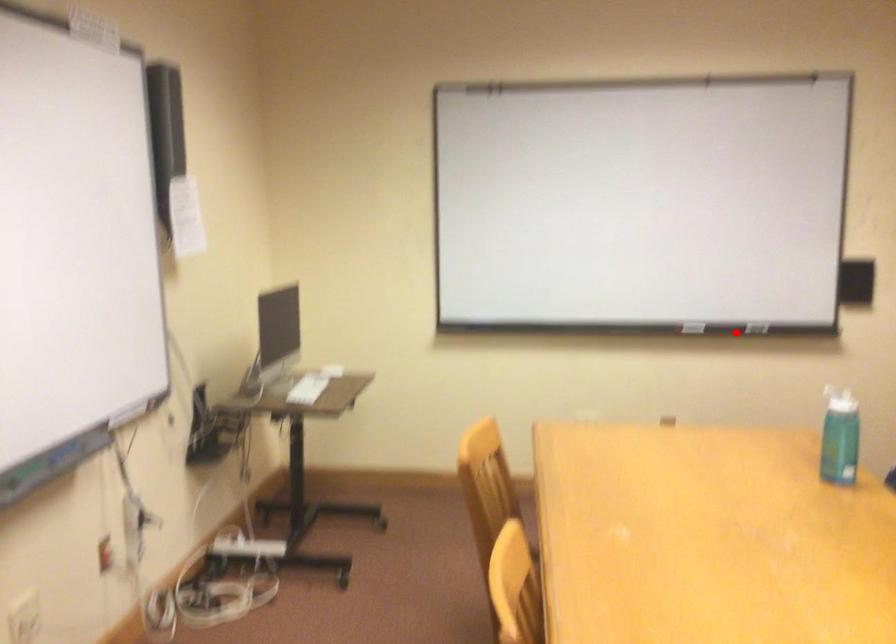
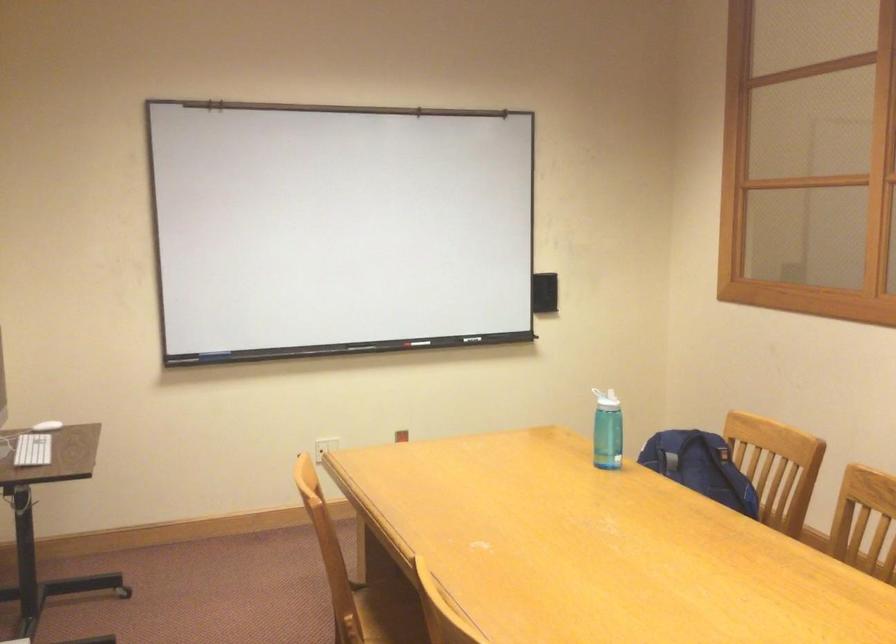
Question: I am providing you with two images of the same scene from different viewpoints. A red point is shown in image1. For the corresponding object point in image2, is it positioned nearer or farther from the camera?

Choices:
 (A) Nearer
 (B) Farther

Answer: (B)